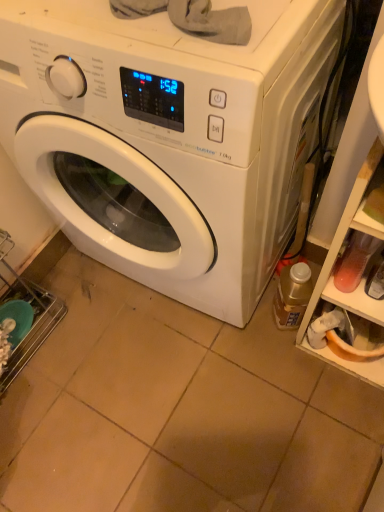
Question: Would you say white glossy washing machine at center is inside or outside translucent plastic bottle at lower right?

Choices:
 (A) inside
 (B) outside

Answer: (B)

Question: Considering the positions of white glossy washing machine at center and translucent plastic bottle at lower right in the image, is white glossy washing machine at center bigger or smaller than translucent plastic bottle at lower right?

Choices:
 (A) small
 (B) big

Answer: (B)

Question: Considering the real-world distances, which object is closest to the translucent plastic bottle at lower right?

Choices:
 (A) white glossy washing machine at center
 (B) translucent plastic shelf at right

Answer: (B)

Question: Estimate the real-world distances between objects in this image. Which object is farther from the white glossy washing machine at center?

Choices:
 (A) translucent plastic shelf at right
 (B) translucent plastic bottle at lower right

Answer: (B)